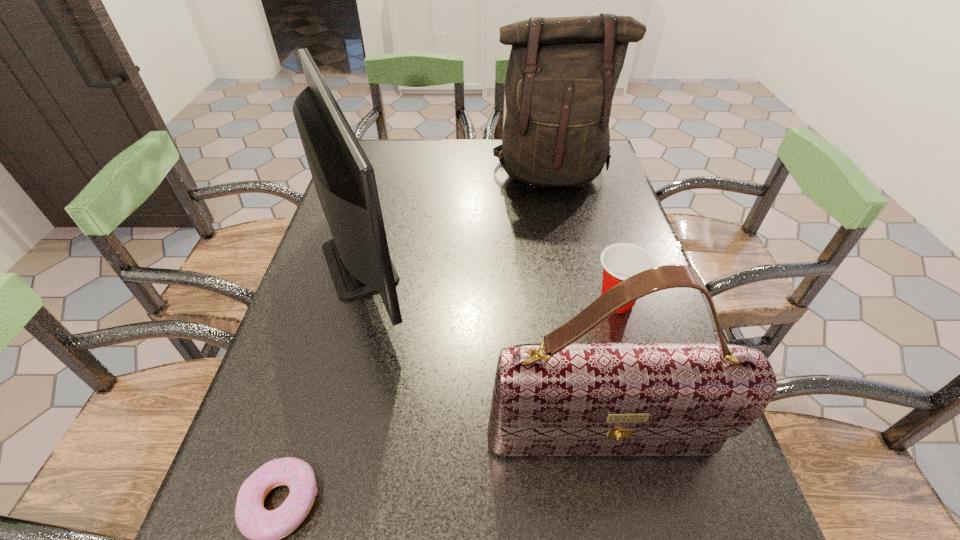
I want to click on backpack located at the right edge, so click(x=562, y=73).

Where is `handbag present at the right edge`? Image resolution: width=960 pixels, height=540 pixels. handbag present at the right edge is located at coordinates (557, 398).

Where is `cup positioned at the right edge`? cup positioned at the right edge is located at coordinates coord(620,261).

Locate an element on the screen. The width and height of the screenshot is (960, 540). object positioned at the far right corner is located at coordinates (562, 73).

In the image, there is a desktop. Identify the location of free space at the far edge. [x=492, y=168].

The width and height of the screenshot is (960, 540). In the image, there is a desktop. Find the location of `free region at the left edge`. free region at the left edge is located at coordinates (345, 367).

Locate an element on the screen. free space at the right edge of the desktop is located at coordinates (595, 219).

What are the coordinates of `free location at the far left corner` in the screenshot? It's located at (401, 174).

Image resolution: width=960 pixels, height=540 pixels. Find the location of `blank region between the fourth tallest object and the backpack`. blank region between the fourth tallest object and the backpack is located at coordinates (585, 237).

Find the location of a particular element. The image size is (960, 540). free point between the handbag and the farthest object is located at coordinates (576, 307).